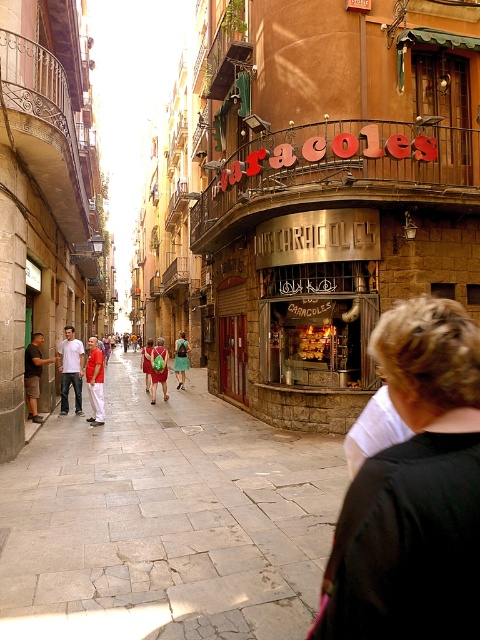
In the scene shown: Does matte khaki shorts at left have a lesser height compared to green backpack at center?

No.

Does matte khaki shorts at left have a larger size compared to green backpack at center?

No, matte khaki shorts at left is not bigger than green backpack at center.

Does point (38, 380) come farther from viewer compared to point (160, 362)?

No, it is not.

Where is `matte khaki shorts at left`? matte khaki shorts at left is located at coordinates (34, 374).

Between gray stone pavement at center and matte khaki shorts at left, which one is positioned higher?

Result: matte khaki shorts at left is higher up.

Does gray stone pavement at center have a lesser height compared to matte khaki shorts at left?

Yes, gray stone pavement at center is shorter than matte khaki shorts at left.

Between point (83, 592) and point (31, 358), which one is positioned behind?

The point (31, 358) is behind.

Locate an element on the screen. gray stone pavement at center is located at coordinates pos(166,522).

Does point (180, 356) lie behind point (142, 358)?

That is False.

Does green fabric dress at center have a smaller size compared to green fabric bag at center?

Yes.

Between point (180, 339) and point (145, 388), which one is positioned behind?

The point (180, 339) is more distant.

You are a GUI agent. You are given a task and a screenshot of the screen. Output one action in this format:
    pyautogui.click(x=<x>, y=<y>)
    Task: Click on the green fabric dress at center
    
    Given the screenshot: What is the action you would take?
    pyautogui.click(x=180, y=358)